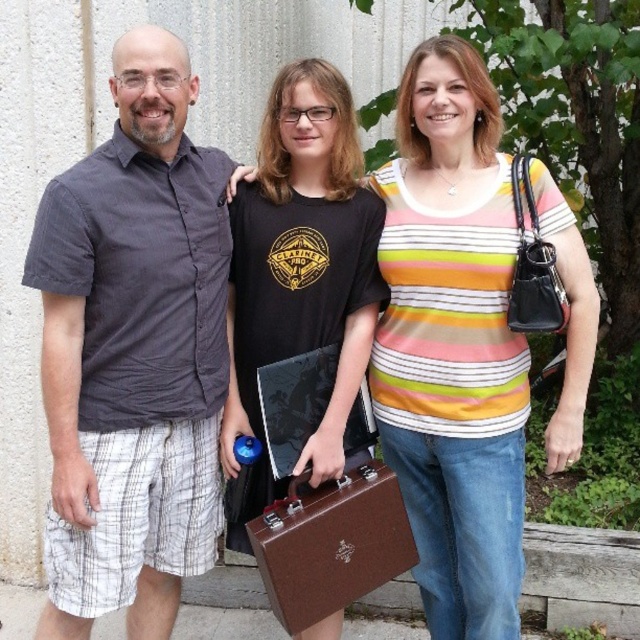
You are a photographer trying to adjust the focus of your camera. The focus point is currently at the center of the image, which is at coordinates point 0.5, 0.5. Is the gray cotton shirt at center located above or below the current focus point?

The gray cotton shirt at center is located below the current focus point because its position is at point (132, 353), which is below the center point (320, 320).

You are a photographer trying to focus on the gray cotton shirt at center and the brown leather briefcase at center. Which object is closer to the camera?

The gray cotton shirt at center is closer to the camera because it is in front of the brown leather briefcase at center.